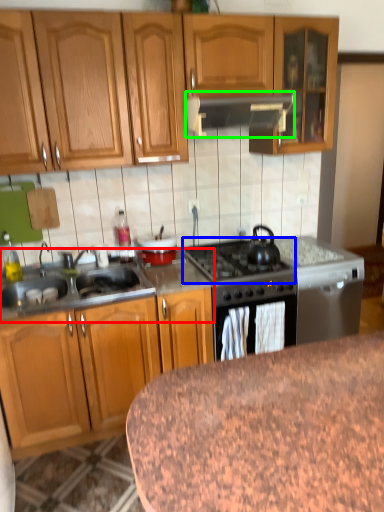
Question: Estimate the real-world distances between objects in this image. Which object is farther from countertop (highlighted by a red box), gas stove (highlighted by a blue box) or kitchen appliance (highlighted by a green box)?

Choices:
 (A) gas stove
 (B) kitchen appliance

Answer: (B)